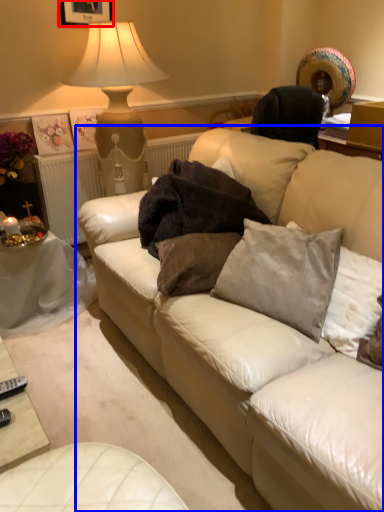
Question: Among these objects, which one is nearest to the camera, picture frame (highlighted by a red box) or studio couch (highlighted by a blue box)?

Choices:
 (A) picture frame
 (B) studio couch

Answer: (B)